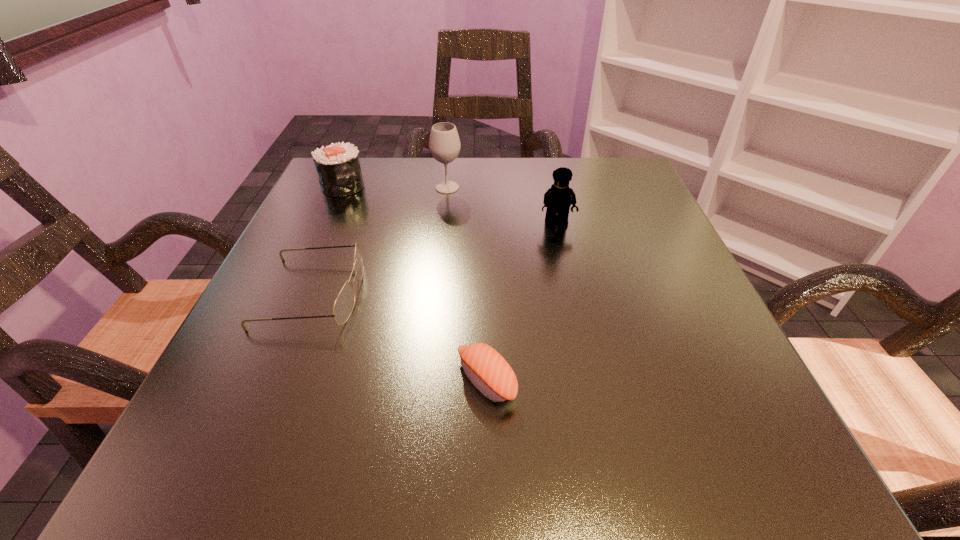
Where is `free spot that satisfies the following two spatial constraints: 1. on the front-facing side of the third farthest object; 2. on the front-facing side of the spectacles`? free spot that satisfies the following two spatial constraints: 1. on the front-facing side of the third farthest object; 2. on the front-facing side of the spectacles is located at coordinates (572, 293).

Where is `vacant space that satisfies the following two spatial constraints: 1. on the front-facing side of the rightmost object; 2. on the front-facing side of the second nearest object`? The width and height of the screenshot is (960, 540). vacant space that satisfies the following two spatial constraints: 1. on the front-facing side of the rightmost object; 2. on the front-facing side of the second nearest object is located at coordinates (572, 293).